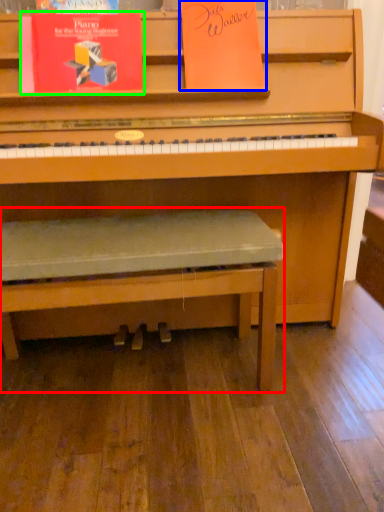
Question: Which object is positioned closest to church bench (highlighted by a red box)? Select from paperback book (highlighted by a blue box) and paperback book (highlighted by a green box).

Choices:
 (A) paperback book
 (B) paperback book

Answer: (B)